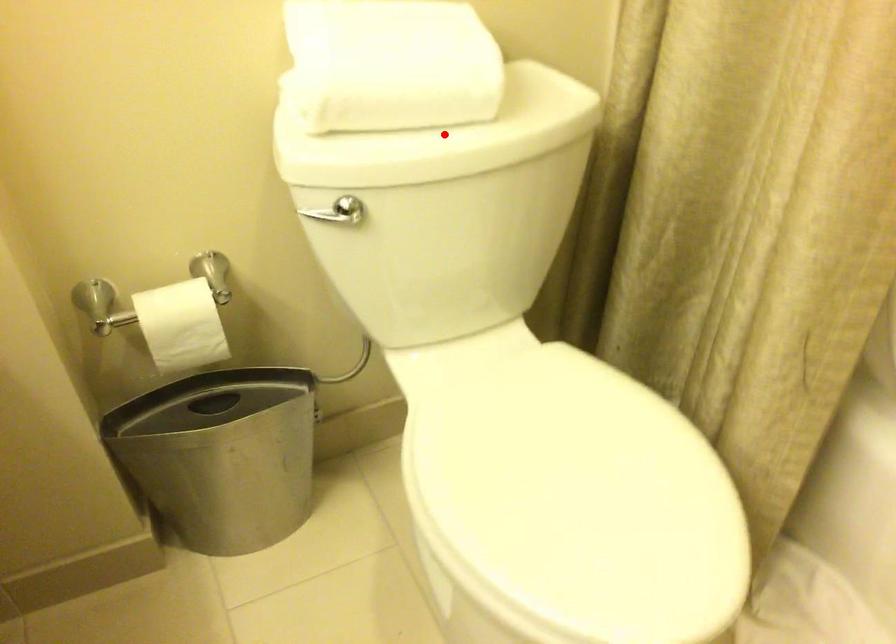
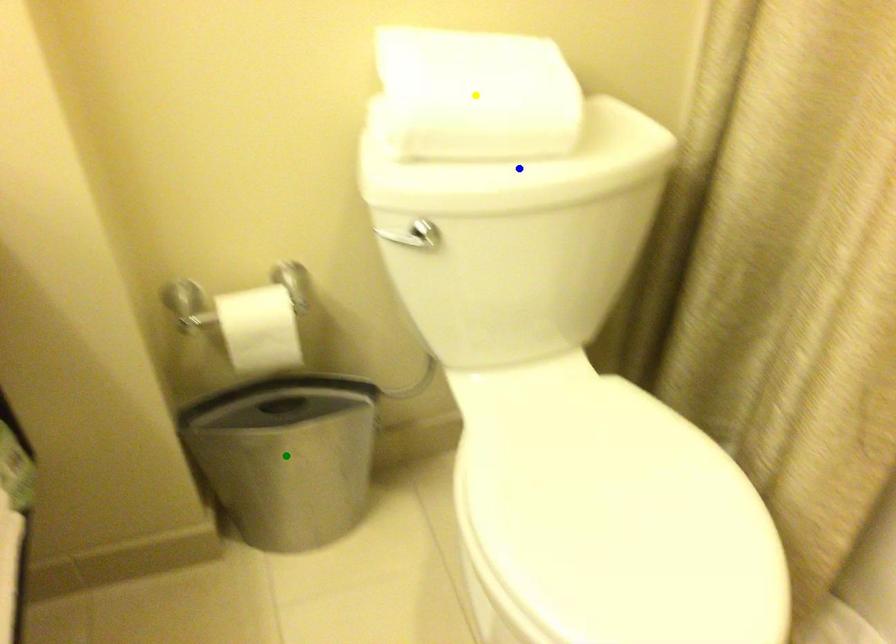
Question: I am providing you with two images of the same scene from different viewpoints. A red point is marked on the first image. You are given multiple points on the second image. Can you choose the point in image 2 that corresponds to the point in image 1?

Choices:
 (A) yellow point
 (B) blue point
 (C) green point

Answer: (B)